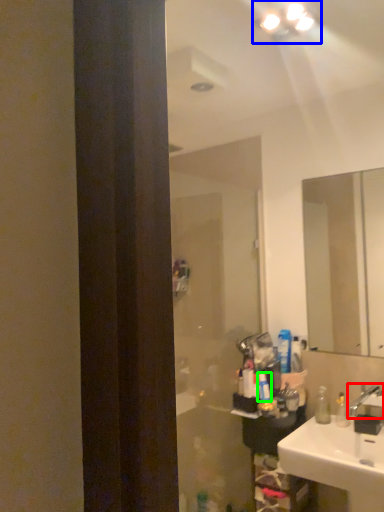
Question: Estimate the real-world distances between objects in this image. Which object is farther from tap (highlighted by a red box), light fixture (highlighted by a blue box) or toiletry (highlighted by a green box)?

Choices:
 (A) light fixture
 (B) toiletry

Answer: (A)